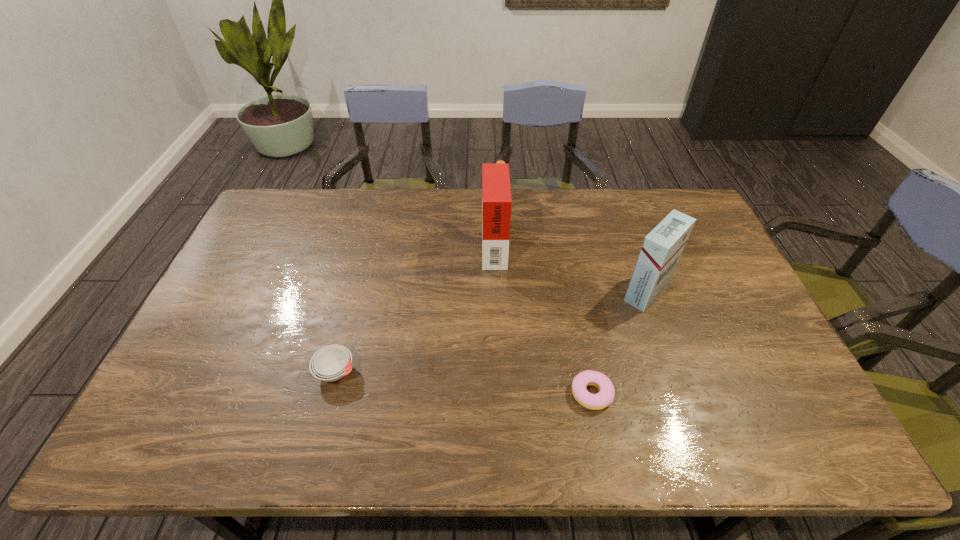
This screenshot has height=540, width=960. What are the coordinates of `object that can be found as the second closest to the nearer cigarette case` in the screenshot? It's located at (496, 194).

Point out which object is positioned as the third nearest to the doughnut. Please provide its 2D coordinates. Your answer should be formatted as a tuple, i.e. [(x, y)], where the tuple contains the x and y coordinates of a point satisfying the conditions above.

[(330, 363)]

Where is `free space in the image that satisfies the following two spatial constraints: 1. on the front-facing side of the farther cigarette case; 2. on the front side of the soup bowl`? The image size is (960, 540). free space in the image that satisfies the following two spatial constraints: 1. on the front-facing side of the farther cigarette case; 2. on the front side of the soup bowl is located at coordinates (498, 372).

The width and height of the screenshot is (960, 540). What are the coordinates of `free region that satisfies the following two spatial constraints: 1. on the back side of the second farthest object; 2. on the right side of the second shortest object` in the screenshot? It's located at (357, 291).

Find the location of a particular element. free space that satisfies the following two spatial constraints: 1. on the front-facing side of the left cigarette case; 2. on the left side of the second object from right to left is located at coordinates (499, 393).

Where is `vacant space that satisfies the following two spatial constraints: 1. on the front-facing side of the farthest object; 2. on the left side of the right cigarette case`? vacant space that satisfies the following two spatial constraints: 1. on the front-facing side of the farthest object; 2. on the left side of the right cigarette case is located at coordinates (495, 291).

This screenshot has width=960, height=540. I want to click on free space that satisfies the following two spatial constraints: 1. on the back side of the nearer cigarette case; 2. on the front-facing side of the third object from right to left, so click(630, 244).

The image size is (960, 540). I want to click on vacant region that satisfies the following two spatial constraints: 1. on the front-facing side of the farther cigarette case; 2. on the right side of the third nearest object, so click(x=495, y=291).

Identify the location of free space that satisfies the following two spatial constraints: 1. on the front side of the shortest object; 2. on the left side of the leftmost object. (330, 393).

You are a GUI agent. You are given a task and a screenshot of the screen. Output one action in this format:
    pyautogui.click(x=<x>, y=<y>)
    Task: Click on the free location that satisfies the following two spatial constraints: 1. on the front-facing side of the third object from left to right; 2. on the right side of the farthest object
    This screenshot has height=540, width=960.
    Given the screenshot: What is the action you would take?
    pyautogui.click(x=499, y=393)